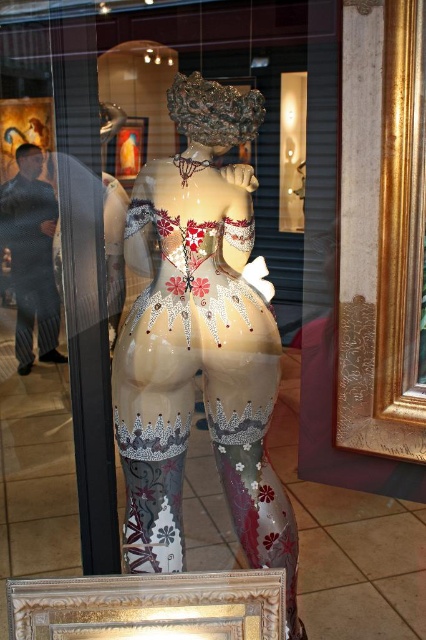
Who is higher up, glossy ceramic statue at center or gold ornate frame at lower center?

glossy ceramic statue at center is higher up.

Is glossy ceramic statue at center smaller than gold ornate frame at lower center?

No, glossy ceramic statue at center is not smaller than gold ornate frame at lower center.

Is point (233, 268) in front of point (210, 589)?

No, it is not.

Locate an element on the screen. The height and width of the screenshot is (640, 426). glossy ceramic statue at center is located at coordinates (199, 342).

From the picture: Can you confirm if gold ornate frame at lower center is positioned to the left of gold metallic picture frame at upper center?

No, gold ornate frame at lower center is not to the left of gold metallic picture frame at upper center.

Can you confirm if gold ornate frame at lower center is thinner than gold metallic picture frame at upper center?

Incorrect, gold ornate frame at lower center's width is not less than gold metallic picture frame at upper center's.

Image resolution: width=426 pixels, height=640 pixels. What do you see at coordinates (149, 605) in the screenshot?
I see `gold ornate frame at lower center` at bounding box center [149, 605].

At what (x,y) coordinates should I click in order to perform the action: click on gold ornate frame at lower center. Please return your answer as a coordinate pair (x, y). Looking at the image, I should click on (149, 605).

Is glossy ceramic statue at center in front of gold metallic picture frame at upper center?

That is True.

Can you confirm if glossy ceramic statue at center is smaller than gold metallic picture frame at upper center?

Incorrect, glossy ceramic statue at center is not smaller in size than gold metallic picture frame at upper center.

The height and width of the screenshot is (640, 426). Describe the element at coordinates (199, 342) in the screenshot. I see `glossy ceramic statue at center` at that location.

Find the location of a particular element. The image size is (426, 640). glossy ceramic statue at center is located at coordinates (199, 342).